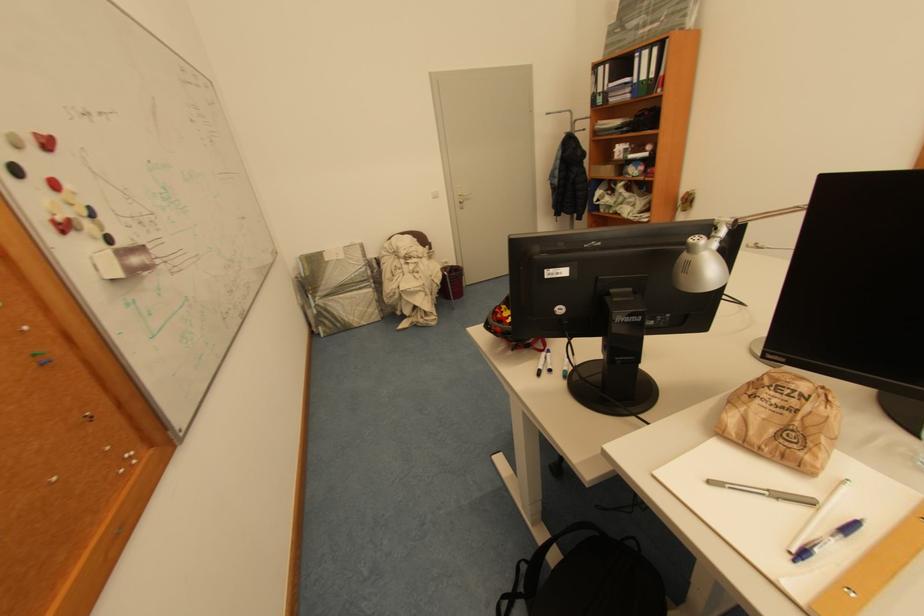
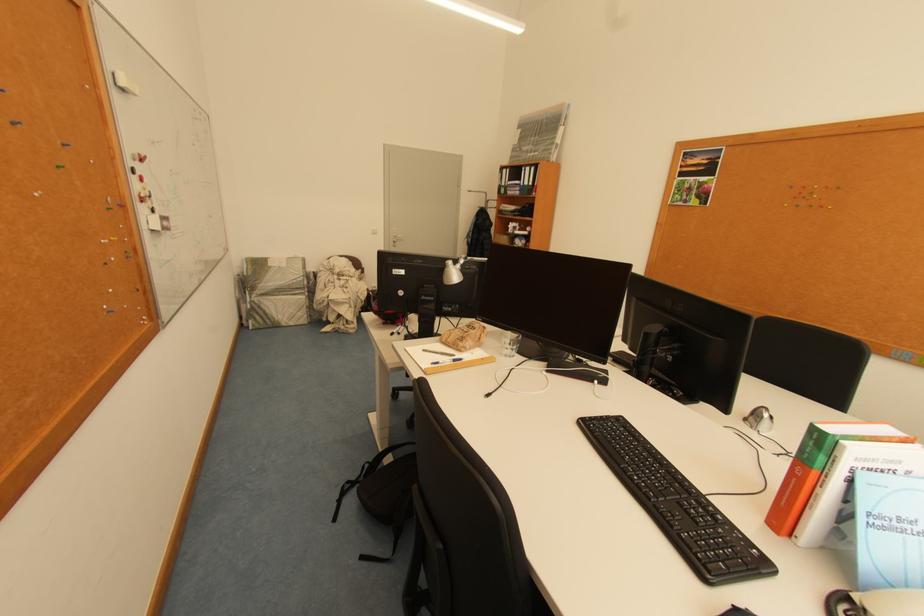
Find the pixel in the second image that matches point 800,389 in the first image.

(481, 328)